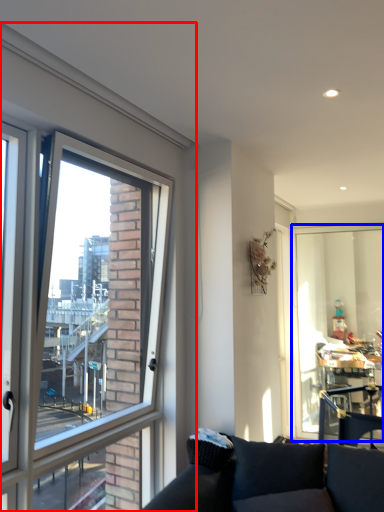
Question: Among these objects, which one is farthest to the camera, window (highlighted by a red box) or window screen (highlighted by a blue box)?

Choices:
 (A) window
 (B) window screen

Answer: (B)